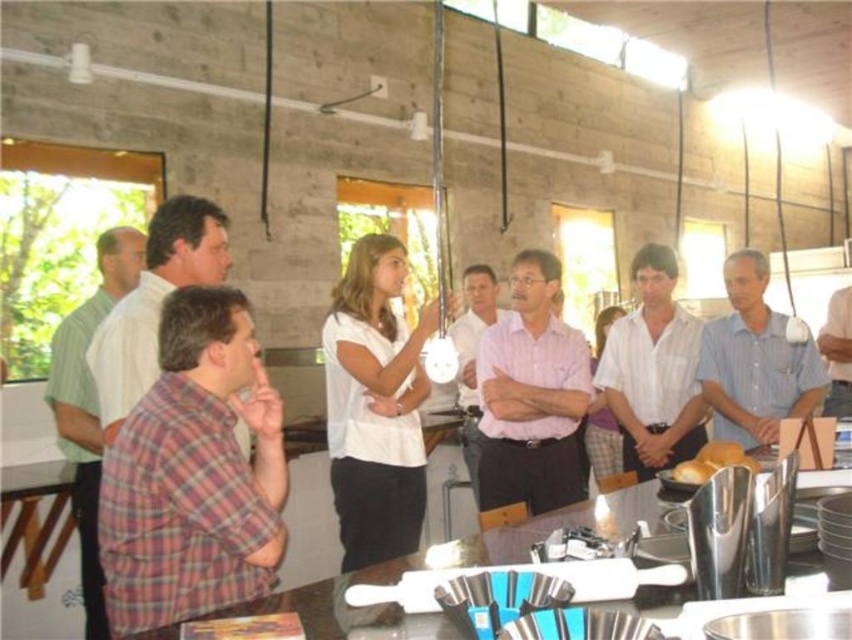
Is white cotton shirt at center thinner than golden matte bread at center?

No.

Can you confirm if white cotton shirt at center is shorter than golden matte bread at center?

Incorrect, white cotton shirt at center's height does not fall short of golden matte bread at center's.

Between point (684, 433) and point (701, 481), which one is positioned in front?

Positioned in front is point (701, 481).

Locate an element on the screen. The image size is (852, 640). white cotton shirt at center is located at coordinates (654, 371).

Is plaid cotton shirt at left bigger than golden matte bread at center?

Yes.

Does plaid cotton shirt at left have a greater width compared to golden matte bread at center?

Correct, the width of plaid cotton shirt at left exceeds that of golden matte bread at center.

Is point (96, 374) positioned before point (705, 460)?

No, it is not.

Where is `plaid cotton shirt at left`? Image resolution: width=852 pixels, height=640 pixels. plaid cotton shirt at left is located at coordinates (154, 300).

Does point (396, 356) come closer to viewer compared to point (465, 448)?

Yes, it is.

Can you confirm if white matte shirt at center is taller than pink cotton shirt at center?

No.

Is point (327, 349) less distant than point (498, 307)?

Yes, it is.

Locate an element on the screen. white matte shirt at center is located at coordinates (375, 404).